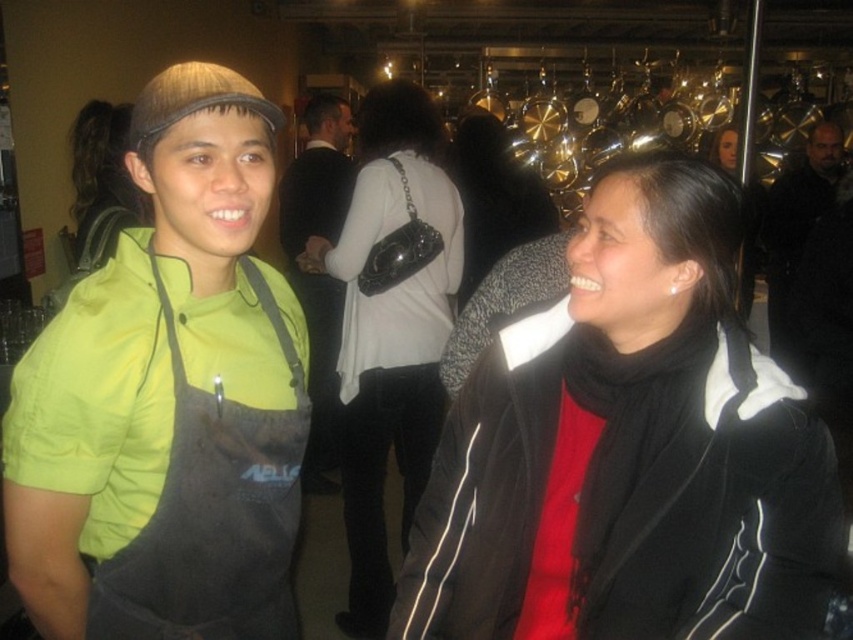
Question: Can you confirm if black matte jacket at center is positioned above matte black purse at center?

Choices:
 (A) yes
 (B) no

Answer: (B)

Question: Which object appears farthest from the camera in this image?

Choices:
 (A) dark gray suit at center
 (B) matte black purse at center
 (C) green matte apron at left
 (D) black matte jacket at center

Answer: (A)

Question: Which object is the closest to the black matte jacket at center?

Choices:
 (A) dark brown leather jacket at upper right
 (B) dark gray suit at center

Answer: (A)

Question: Estimate the real-world distances between objects in this image. Which object is closer to the green matte apron at left?

Choices:
 (A) dark gray suit at center
 (B) dark brown leather jacket at upper right

Answer: (A)

Question: Is black matte jacket at center below dark brown leather jacket at upper right?

Choices:
 (A) no
 (B) yes

Answer: (B)

Question: Can you confirm if black matte jacket at center is wider than dark gray suit at center?

Choices:
 (A) no
 (B) yes

Answer: (B)